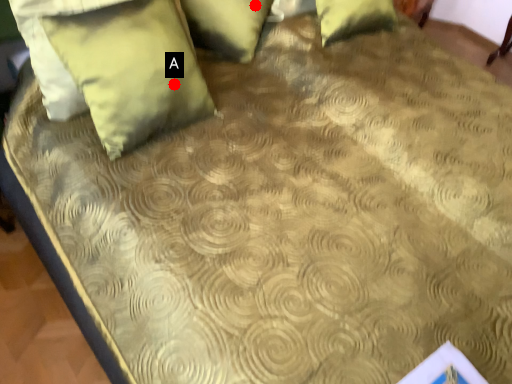
Question: Two points are circled on the image, labeled by A and B beside each circle. Which point is closer to the camera taking this photo?

Choices:
 (A) A is closer
 (B) B is closer

Answer: (A)